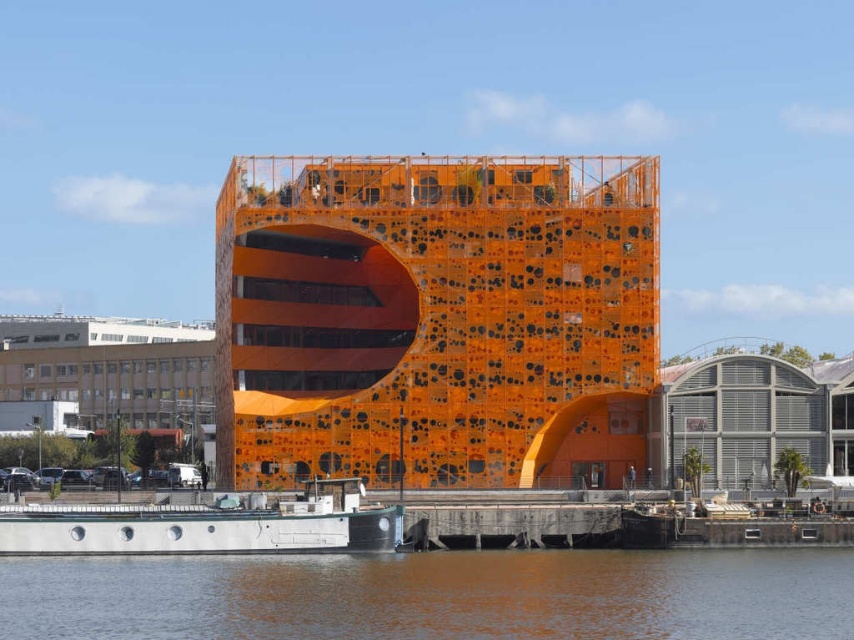
Question: Is orange perforated metal building at center bigger than metallic gray warehouse at right?

Choices:
 (A) no
 (B) yes

Answer: (B)

Question: Is orange perforated metal building at center above metallic gray boat at lower left?

Choices:
 (A) no
 (B) yes

Answer: (B)

Question: Which point is closer to the camera?

Choices:
 (A) 279,376
 (B) 197,531

Answer: (B)

Question: Can you confirm if orange perforated metal building at center is bigger than metallic gray boat at lower left?

Choices:
 (A) no
 (B) yes

Answer: (B)

Question: Which point is farther to the camera?

Choices:
 (A) orange perforated metal building at center
 (B) brown water at lower center
 (C) metallic gray boat at lower left

Answer: (A)

Question: Among these points, which one is nearest to the camera?

Choices:
 (A) (402, 602)
 (B) (730, 381)
 (C) (336, 531)
 (D) (221, 397)

Answer: (A)